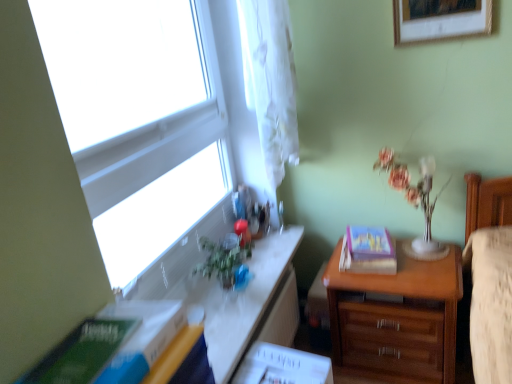
Find the location of a particular element. This screenshot has width=512, height=384. vacant point above hardcover book at right, which appears as the first paperback book when viewed from the right (from a real-world perspective) is located at coordinates pyautogui.click(x=373, y=252).